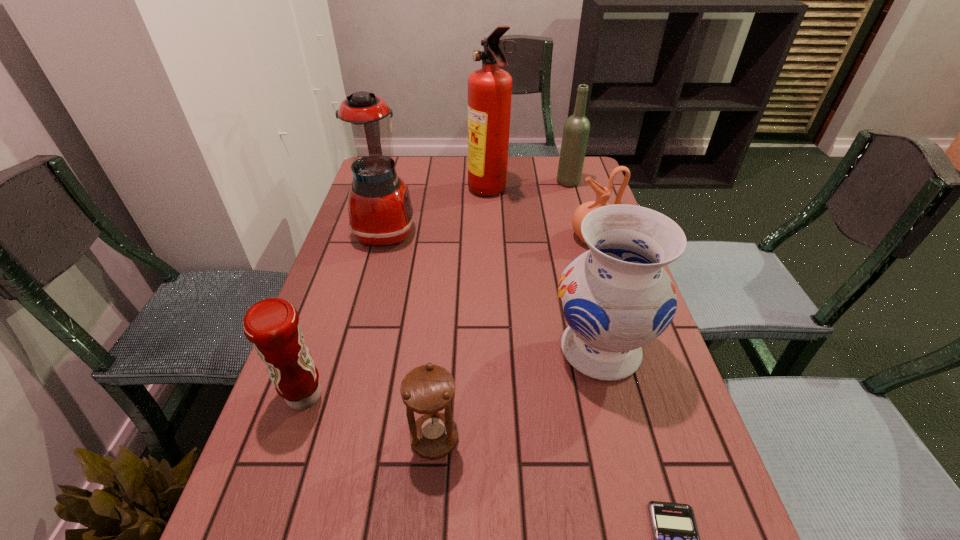
You are a GUI agent. You are given a task and a screenshot of the screen. Output one action in this format:
    pyautogui.click(x=<x>, y=<y>)
    Task: Click on the free point between the pottery and the seventh shortest object
    The image size is (960, 540).
    Given the screenshot: What is the action you would take?
    pyautogui.click(x=490, y=234)

The image size is (960, 540). Identify the location of unoccupied position between the hourglass and the vase. (517, 394).

Where is `free space between the wine bottle and the condiment`? The width and height of the screenshot is (960, 540). free space between the wine bottle and the condiment is located at coordinates (437, 289).

This screenshot has height=540, width=960. What are the coordinates of `free space between the condiment and the wine bottle` in the screenshot? It's located at coord(437,289).

Identify the location of vacant space in between the food processor and the fire extinguisher. The width and height of the screenshot is (960, 540). (437, 211).

Where is `unoccupied area between the condiment and the pottery`? The image size is (960, 540). unoccupied area between the condiment and the pottery is located at coordinates (448, 317).

I want to click on vacant area that lies between the pottery and the second shortest object, so click(514, 338).

Identify the location of the sixth closest object relative to the second tallest object. Image resolution: width=960 pixels, height=540 pixels. (427, 389).

What are the coordinates of `the seventh closest object to the vase` in the screenshot? It's located at (576, 130).

Locate an element on the screen. Image resolution: width=960 pixels, height=540 pixels. free location that satisfies the following two spatial constraints: 1. on the controls of the food processor; 2. on the back side of the vase is located at coordinates (353, 350).